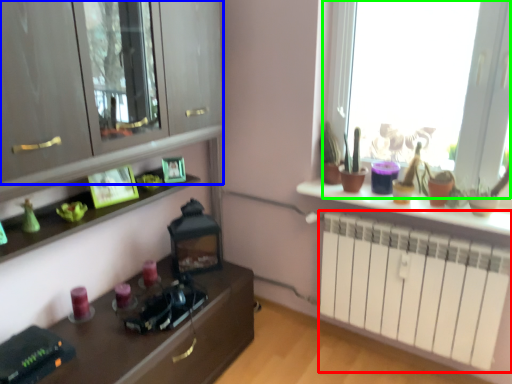
Question: Which object is the closest to the radiator (highlighted by a red box)? Choose among these: cabinetry (highlighted by a blue box) or window (highlighted by a green box).

Choices:
 (A) cabinetry
 (B) window

Answer: (B)